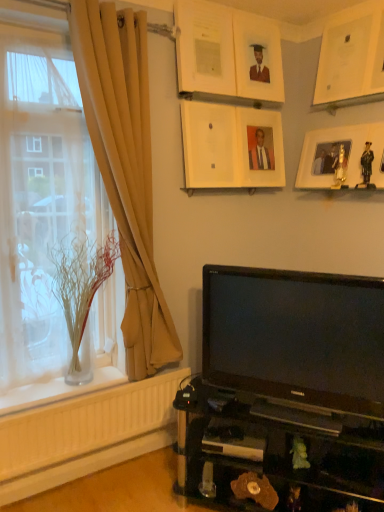
The height and width of the screenshot is (512, 384). What are the coordinates of `blank space situated above matte white picture frame at upper center, the 1th picture frame viewed from the left (from a real-world perspective)` in the screenshot? It's located at (208, 4).